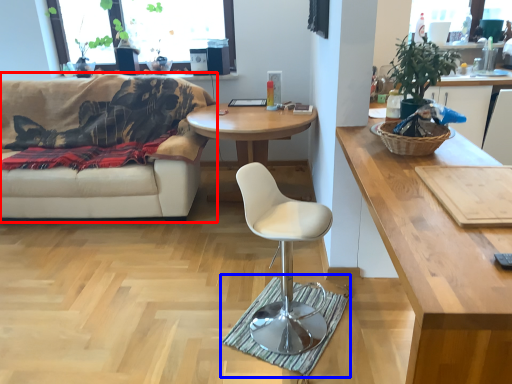
Question: Which point is further to the camera, studio couch (highlighted by a red box) or mat (highlighted by a blue box)?

Choices:
 (A) studio couch
 (B) mat

Answer: (A)